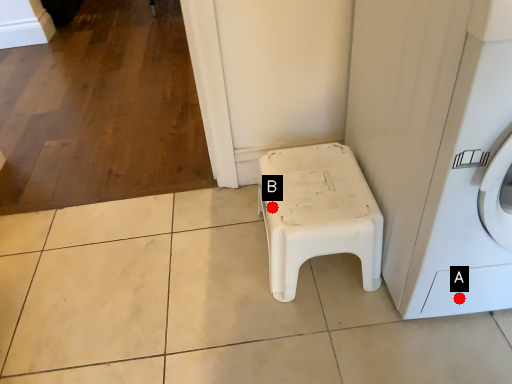
Question: Two points are circled on the image, labeled by A and B beside each circle. Which point is closer to the camera?

Choices:
 (A) A is closer
 (B) B is closer

Answer: (A)